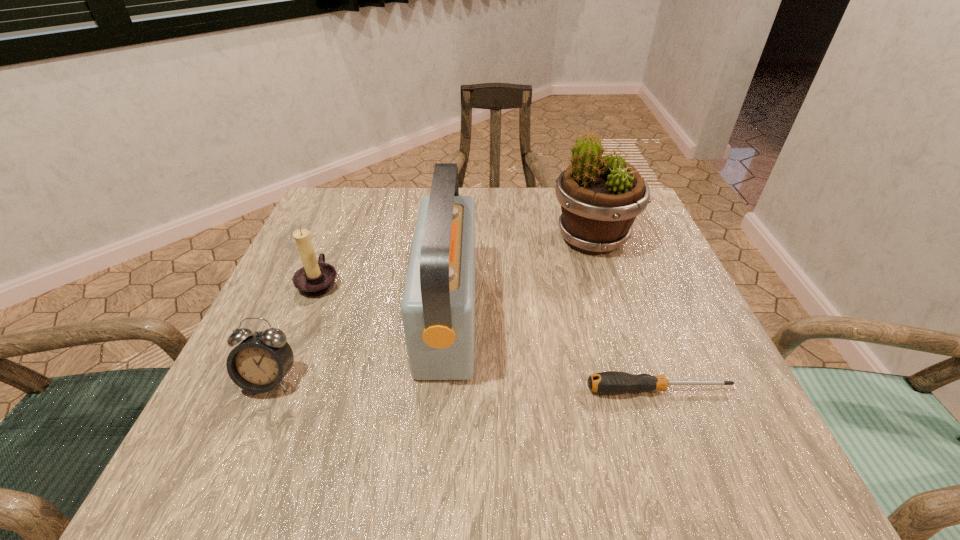
Locate an element on the screen. This screenshot has width=960, height=540. object located at the far edge is located at coordinates (600, 197).

Locate an element on the screen. This screenshot has height=540, width=960. candle holder that is at the left edge is located at coordinates (315, 278).

Image resolution: width=960 pixels, height=540 pixels. Identify the location of alarm clock at the left edge. (258, 364).

Find the location of `flowerpot that is positioned at the right edge`. flowerpot that is positioned at the right edge is located at coordinates (600, 197).

Find the location of a particular element. The image size is (960, 540). screwdriver present at the right edge is located at coordinates (610, 382).

Identify the location of object located in the far right corner section of the desktop. (600, 197).

In the image, there is a desktop. At what (x,y) coordinates should I click in order to perform the action: click on free region at the far edge. Please return your answer as a coordinate pair (x, y). Looking at the image, I should click on (496, 194).

In the image, there is a desktop. Identify the location of vacant space at the near edge. (502, 451).

Find the location of a particular element. The image size is (960, 540). vacant space at the left edge of the desktop is located at coordinates (328, 258).

This screenshot has height=540, width=960. In the image, there is a desktop. What are the coordinates of `vacant space at the right edge` in the screenshot? It's located at (612, 295).